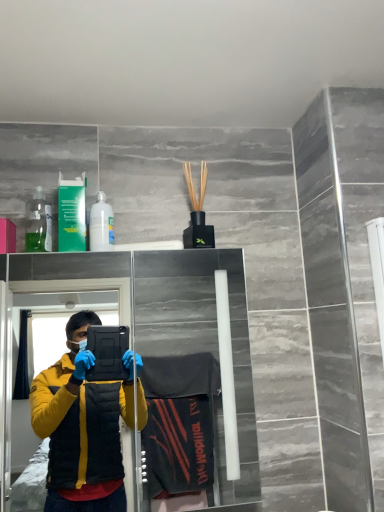
Identify the location of transparent plastic bottle at upper left. The width and height of the screenshot is (384, 512). (38, 223).

This screenshot has height=512, width=384. What do you see at coordinates (101, 225) in the screenshot?
I see `white matte bottle at upper left` at bounding box center [101, 225].

Image resolution: width=384 pixels, height=512 pixels. I want to click on transparent glass door at upper center, so click(x=170, y=324).

Find the location of a particular element. transparent plastic bottle at upper left is located at coordinates (x=38, y=223).

Considering the relative sizes of white matte bottle at upper left and transparent glass door at upper center in the image provided, is white matte bottle at upper left taller than transparent glass door at upper center?

In fact, white matte bottle at upper left may be shorter than transparent glass door at upper center.

From a real-world perspective, is white matte bottle at upper left physically located above or below transparent glass door at upper center?

white matte bottle at upper left is above transparent glass door at upper center.

Considering the relative sizes of white matte bottle at upper left and transparent glass door at upper center in the image provided, is white matte bottle at upper left wider than transparent glass door at upper center?

No.

Does point (102, 205) come behind point (38, 202)?

No, (102, 205) is closer to viewer.

Is white matte bottle at upper left oriented away from transparent plastic bottle at upper left?

white matte bottle at upper left does not have its back to transparent plastic bottle at upper left.

Looking at this image, which object is positioned more to the right, white matte bottle at upper left or transparent plastic bottle at upper left?

white matte bottle at upper left.

Which of these two, white matte bottle at upper left or transparent plastic bottle at upper left, is bigger?

transparent plastic bottle at upper left is bigger.

From the picture: Is transparent plastic bottle at upper left in front of or behind transparent glass door at upper center in the image?

Visually, transparent plastic bottle at upper left is located behind transparent glass door at upper center.

Consider the image. From the image's perspective, would you say transparent plastic bottle at upper left is positioned over transparent glass door at upper center?

Correct, transparent plastic bottle at upper left appears higher than transparent glass door at upper center in the image.

The height and width of the screenshot is (512, 384). I want to click on glass door that is under the transparent plastic bottle at upper left (from a real-world perspective), so click(170, 324).

Is the surface of transparent plastic bottle at upper left in direct contact with transparent glass door at upper center?

They are not placed beside each other.

I want to click on toiletry behind the transparent glass door at upper center, so click(x=101, y=225).

Which is behind, point (216, 317) or point (91, 237)?

The point (216, 317) is behind.

In the scene shown: From a real-world perspective, is transparent glass door at upper center physically below white matte bottle at upper left?

Yes, from a real-world perspective, transparent glass door at upper center is below white matte bottle at upper left.

From a real-world perspective, relative to white matte bottle at upper left, is transparent plastic bottle at upper left vertically above or below?

transparent plastic bottle at upper left is situated higher than white matte bottle at upper left in the real world.

Can you confirm if transparent plastic bottle at upper left is wider than white matte bottle at upper left?

No, transparent plastic bottle at upper left is not wider than white matte bottle at upper left.

Is transparent plastic bottle at upper left outside of white matte bottle at upper left?

transparent plastic bottle at upper left is positioned outside white matte bottle at upper left.

Find the location of `toiletry that is on the right side of transparent plastic bottle at upper left`. toiletry that is on the right side of transparent plastic bottle at upper left is located at coordinates (101, 225).

From their relative heights in the image, would you say transparent glass door at upper center is taller or shorter than transparent plastic bottle at upper left?

Clearly, transparent glass door at upper center is taller compared to transparent plastic bottle at upper left.

Can we say transparent glass door at upper center lies outside transparent plastic bottle at upper left?

Yes, transparent glass door at upper center is located beyond the bounds of transparent plastic bottle at upper left.

Which object is closer to the camera taking this photo, transparent glass door at upper center or transparent plastic bottle at upper left?

transparent glass door at upper center is more forward.

I want to click on toiletry that appears above the transparent glass door at upper center (from the image's perspective), so click(x=101, y=225).

This screenshot has height=512, width=384. Find the location of `bottle positioned vertically above the white matte bottle at upper left (from a real-world perspective)`. bottle positioned vertically above the white matte bottle at upper left (from a real-world perspective) is located at coordinates tap(38, 223).

From the image, which object appears to be nearer to white matte bottle at upper left, transparent glass door at upper center or transparent plastic bottle at upper left?

Among the two, transparent plastic bottle at upper left is located nearer to white matte bottle at upper left.

Considering their positions, is white matte bottle at upper left positioned closer to transparent plastic bottle at upper left than transparent glass door at upper center?

Based on the image, white matte bottle at upper left appears to be nearer to transparent plastic bottle at upper left.

From the image, which object appears to be nearer to transparent glass door at upper center, transparent plastic bottle at upper left or white matte bottle at upper left?

The object closer to transparent glass door at upper center is white matte bottle at upper left.

Looking at the image, which one is located further to transparent glass door at upper center, white matte bottle at upper left or transparent plastic bottle at upper left?

The object further to transparent glass door at upper center is transparent plastic bottle at upper left.

Looking at the image, which one is located further to white matte bottle at upper left, transparent plastic bottle at upper left or transparent glass door at upper center?

transparent glass door at upper center is positioned further to the anchor white matte bottle at upper left.

Which object lies nearer to the anchor point transparent plastic bottle at upper left, transparent glass door at upper center or white matte bottle at upper left?

white matte bottle at upper left is closer to transparent plastic bottle at upper left.

At what (x,y) coordinates should I click in order to perform the action: click on toiletry between transparent plastic bottle at upper left and transparent glass door at upper center vertically. Please return your answer as a coordinate pair (x, y). The height and width of the screenshot is (512, 384). Looking at the image, I should click on (101, 225).